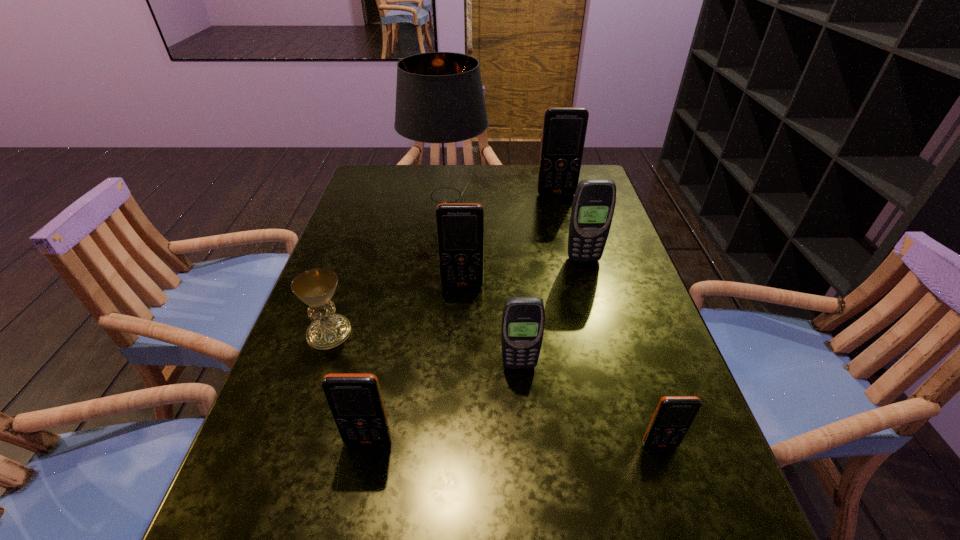
You are a GUI agent. You are given a task and a screenshot of the screen. Output one action in this format:
    pyautogui.click(x=<x>, y=<y>)
    Task: Click on the leftmost cellular telephone
    This screenshot has height=540, width=960.
    Given the screenshot: What is the action you would take?
    pyautogui.click(x=355, y=400)

In order to click on the leftmost orange cellular telephone in this screenshot , I will do `click(355, 400)`.

Identify the location of the fifth farthest object. Image resolution: width=960 pixels, height=540 pixels. (316, 287).

The image size is (960, 540). Find the location of `the leftmost object`. the leftmost object is located at coordinates coord(316,287).

This screenshot has height=540, width=960. What are the coordinates of `the smallest orange cellular telephone` in the screenshot? It's located at (673, 416).

I want to click on vacant region located on the front of the gray lampshade, so (x=433, y=310).

What are the coordinates of `vacant region located 0.110m on the screen of the seventh shortest object` in the screenshot? It's located at (563, 217).

Identify the location of free location located 0.100m on the screen of the second biggest orange cellular telephone. (461, 320).

Locate an element on the screen. The width and height of the screenshot is (960, 540). vacant space located 0.080m on the screen of the bigger gray cellular telephone is located at coordinates (590, 284).

Where is `vacant space located on the screen of the smaller gray cellular telephone`? This screenshot has height=540, width=960. vacant space located on the screen of the smaller gray cellular telephone is located at coordinates (522, 400).